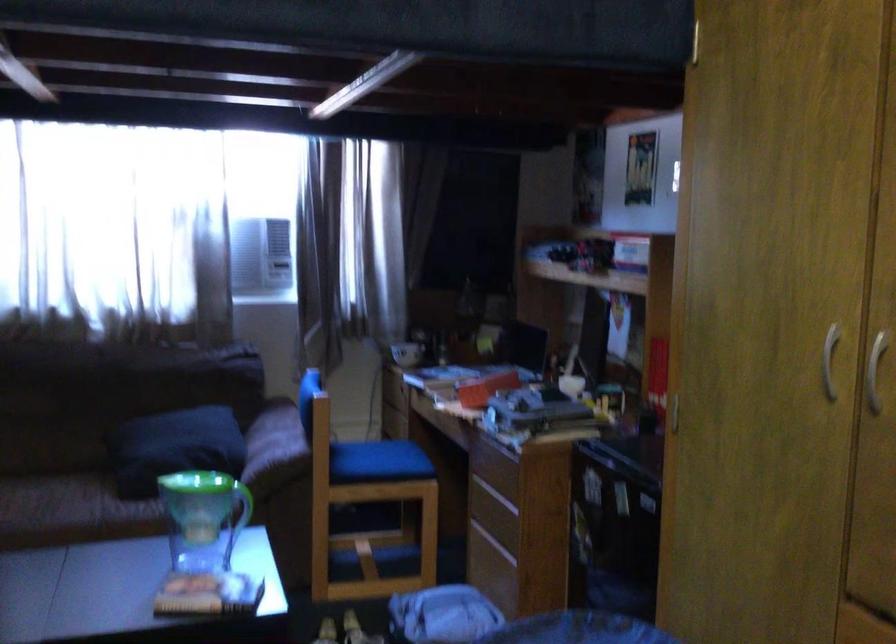
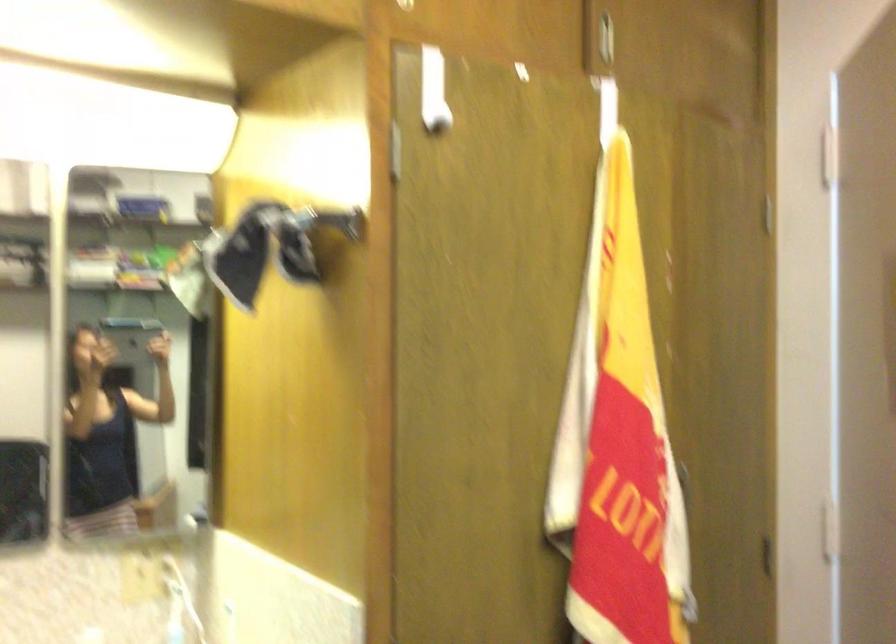
Question: How did the camera likely rotate?

Choices:
 (A) Left
 (B) Right
 (C) Up
 (D) Down

Answer: (B)